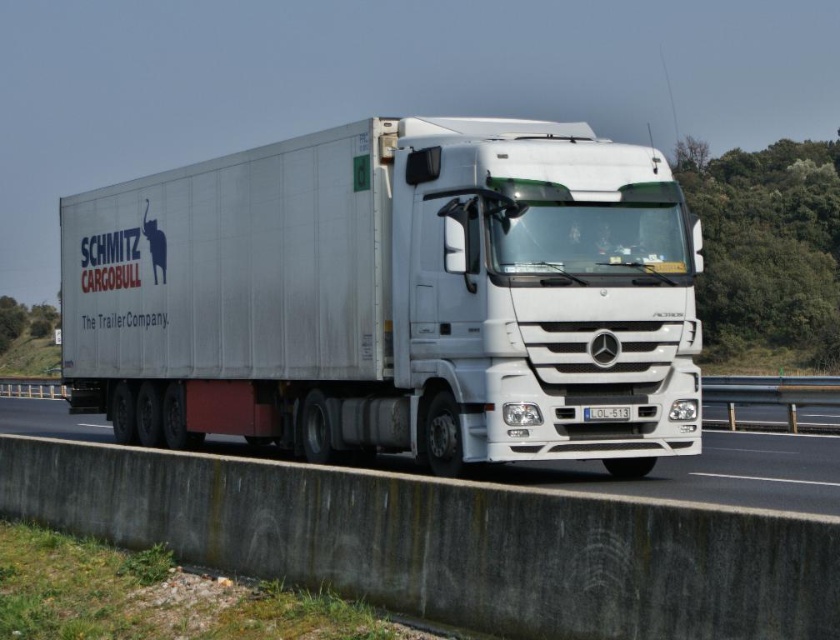
Based on the photo, you are a driver approaching a narrow tunnel entrance. You see the white metallic trailer truck at center and the white glossy concrete barrier at lower center. Which object is narrower, and can the truck pass through the tunnel if the barrier indicates the tunnel entrance width?

The white metallic trailer truck at center is thinner than the white glossy concrete barrier at lower center. Since the barrier indicates the tunnel entrance width, the truck can pass through the tunnel as it is narrower than the entrance.

You are a driver approaching a highway exit ramp. You see the white metallic trailer truck at center and the white glossy concrete barrier at lower center. Which object is positioned higher from the ground?

The white metallic trailer truck at center is above the white glossy concrete barrier at lower center, so it is higher from the ground.

You are a delivery driver who needs to safely pass through a narrow tunnel that is only 10 feet wide. Your truck is currently positioned next to the white glossy concrete barrier at lower center. Can you safely navigate your white metallic trailer truck at center through the tunnel without hitting the barrier?

The white metallic trailer truck at center and white glossy concrete barrier at lower center are 9.35 feet apart. Since the tunnel is 10 feet wide, there is enough space between the truck and the barrier to safely navigate through the tunnel without collision.